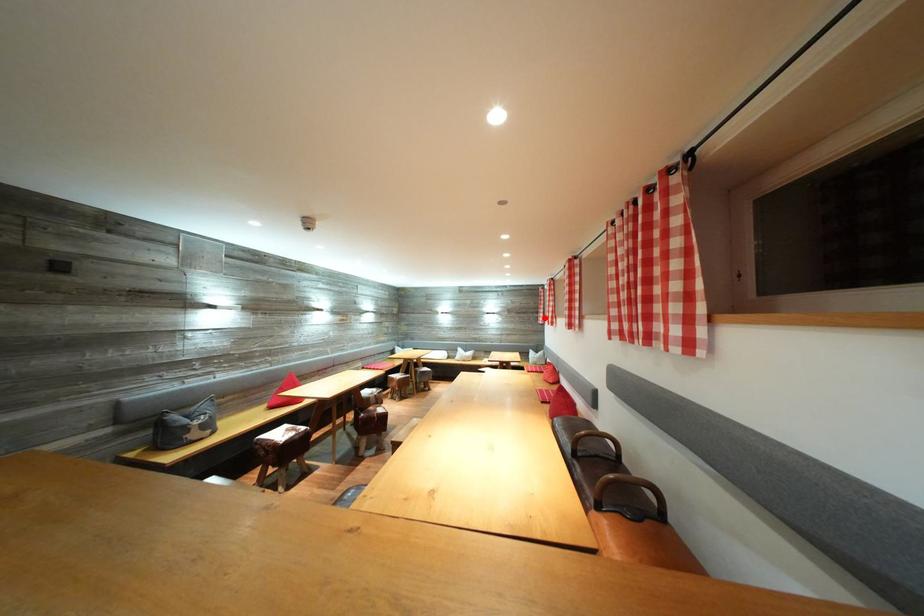
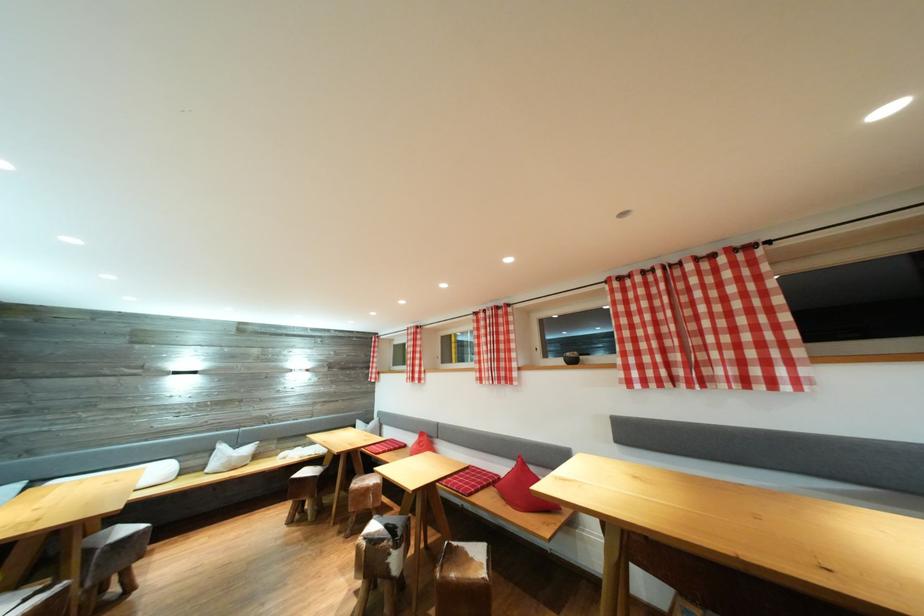
Question: I am providing you with two images of the same scene from different viewpoints. A red point is shown in image1. For the corresponding object point in image2, is it positioned nearer or farther from the camera?

Choices:
 (A) Nearer
 (B) Farther

Answer: (B)